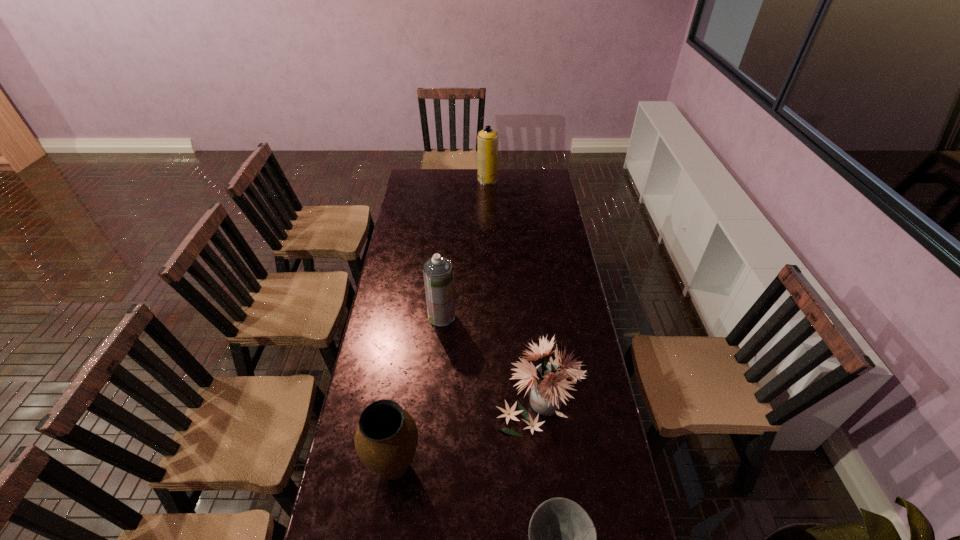
Locate an element on the screen. object that is the third closest to the shortest object is located at coordinates (437, 271).

Choose which object is the second nearest neighbor to the shortest object. Please provide its 2D coordinates. Your answer should be formatted as a tuple, i.e. [(x, y)], where the tuple contains the x and y coordinates of a point satisfying the conditions above.

[(386, 437)]